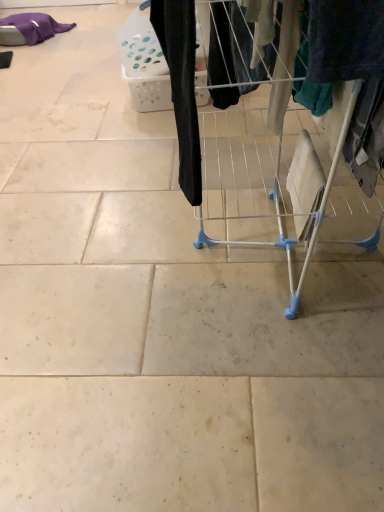
This screenshot has height=512, width=384. In order to click on free point below white wire drying rack at center (from a real-world perspective) in this screenshot , I will do `click(279, 254)`.